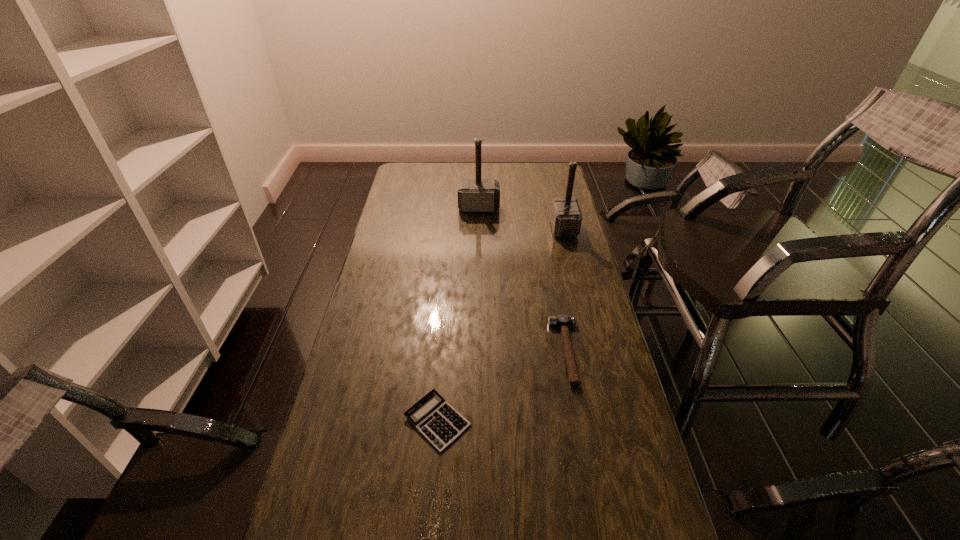
At what (x,y) coordinates should I click in order to perform the action: click on vacant region located on the striking face of the nearest hammer. Please return your answer as a coordinate pair (x, y). Image resolution: width=960 pixels, height=540 pixels. Looking at the image, I should click on (447, 352).

Find the location of a particular element. This screenshot has width=960, height=540. vacant area located on the striking face of the nearest hammer is located at coordinates (516, 352).

Find the location of a particular element. This screenshot has width=960, height=540. free space located 0.100m on the left of the nearest object is located at coordinates (366, 421).

What are the coordinates of `free spot at the far edge of the desktop` in the screenshot? It's located at [496, 176].

The image size is (960, 540). In order to click on vacant space at the left edge in this screenshot , I will do `click(355, 434)`.

This screenshot has height=540, width=960. I want to click on blank area at the right edge, so click(541, 204).

The image size is (960, 540). Find the location of `vacant space at the far right corner of the desktop`. vacant space at the far right corner of the desktop is located at coordinates (552, 181).

Find the location of `empty location between the second shortest object and the third nearest object`. empty location between the second shortest object and the third nearest object is located at coordinates (565, 290).

The height and width of the screenshot is (540, 960). Identify the location of free space that is in between the calculator and the farthest object. (458, 314).

Locate an element on the screen. This screenshot has width=960, height=540. free space between the second farthest hammer and the leftmost hammer is located at coordinates (521, 218).